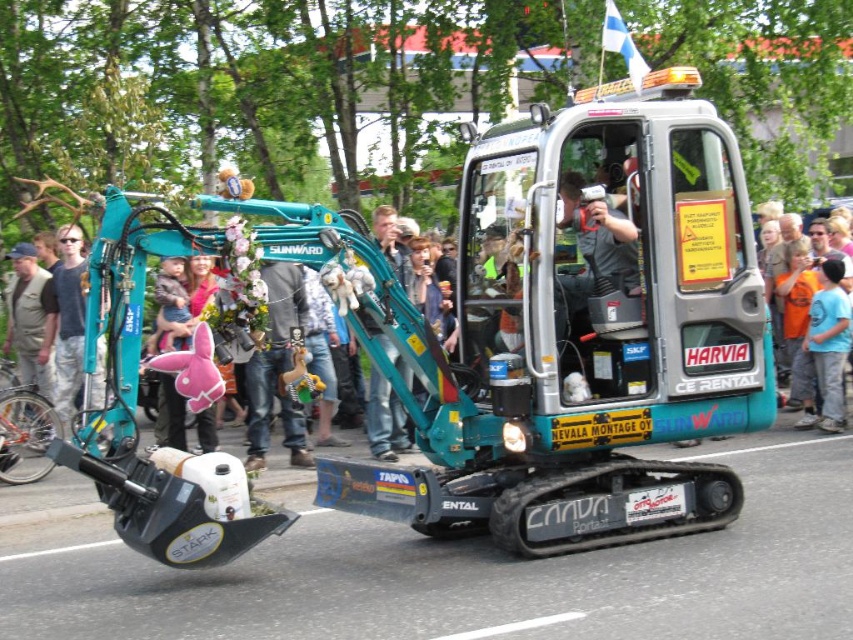
Question: Is teal metallic excavator at center to the right of orange cotton shirt at right from the viewer's perspective?

Choices:
 (A) no
 (B) yes

Answer: (A)

Question: Estimate the real-world distances between objects in this image. Which object is closer to the orange cotton shirt at right?

Choices:
 (A) teal metallic excavator at center
 (B) teal plastic excavator at center

Answer: (A)

Question: Does orange cotton shirt at right lie behind teal plastic excavator at center?

Choices:
 (A) no
 (B) yes

Answer: (B)

Question: Where is orange cotton shirt at right located in relation to teal plastic excavator at center in the image?

Choices:
 (A) right
 (B) left

Answer: (A)

Question: Which is nearer to the teal plastic excavator at center?

Choices:
 (A) orange cotton shirt at right
 (B) teal metallic excavator at center

Answer: (B)

Question: Based on their relative distances, which object is farther from the teal plastic excavator at center?

Choices:
 (A) orange cotton shirt at right
 (B) teal metallic excavator at center

Answer: (A)